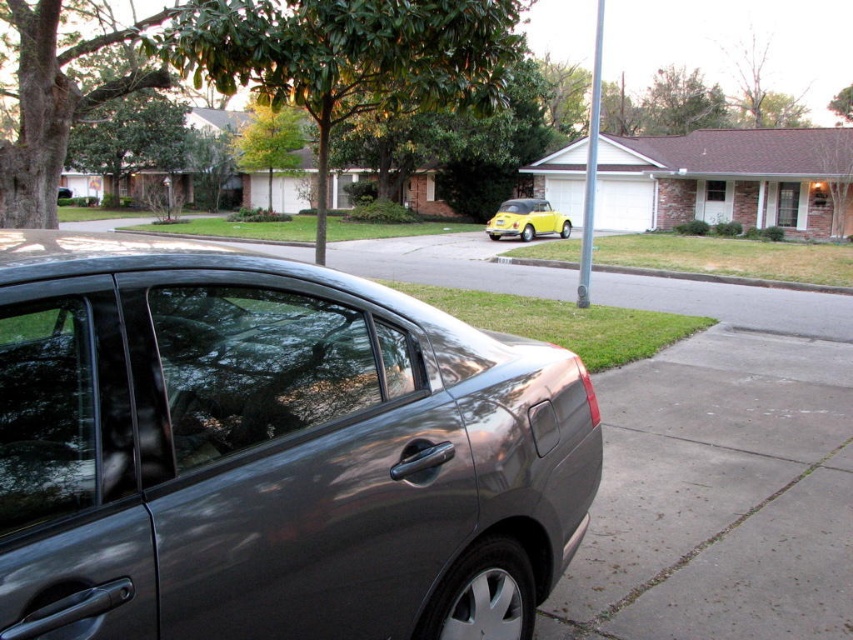
You are a delivery person trying to park your delivery van between the satin metallic sedan at center and the yellow matte car at center. Can you fit your van, which is 6 meters long, in the space between them?

The satin metallic sedan at center is in front of the yellow matte car at center, but the exact distance between them is not provided. Without knowing the space between the two cars, it is impossible to determine if the van will fit.

You are a delivery person trying to park a new car that is 1.5 meters tall. You see the satin metallic sedan at center and the gray concrete pavement at lower right. Can your new car fit in the parking spot where the gray concrete pavement is located?

The satin metallic sedan at center is taller than gray concrete pavement at lower right. Since your car is 1.5 meters tall, if the parking spot requires clearance based on the pavement height, the sedan being taller suggests the pavement might be lower. However, without specific pavement height, it is uncertain. But since the sedan is taller, your car at 1.5m may fit if the pavement allows.